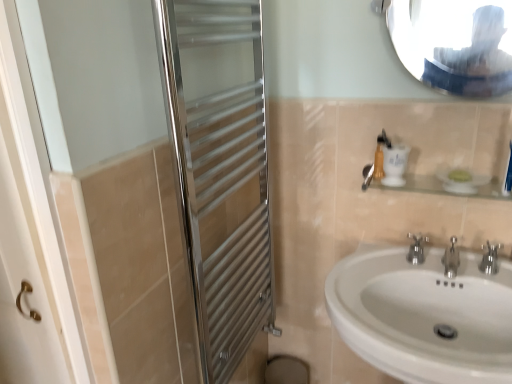
Question: Could you tell me if polished metallic faucet at lower right, which is counted as the third tap, starting from the left, is facing glossy metallic mirror at upper center?

Choices:
 (A) yes
 (B) no

Answer: (B)

Question: Would you say polished metallic faucet at lower right, which is counted as the 1th tap, starting from the right, is outside glossy metallic mirror at upper center?

Choices:
 (A) no
 (B) yes

Answer: (B)

Question: Does polished metallic faucet at lower right, which is counted as the third tap, starting from the left, lie behind glossy metallic mirror at upper center?

Choices:
 (A) no
 (B) yes

Answer: (B)

Question: Does polished metallic faucet at lower right, which is counted as the 1th tap, starting from the right, have a lesser height compared to glossy metallic mirror at upper center?

Choices:
 (A) yes
 (B) no

Answer: (A)

Question: Are polished metallic faucet at lower right, which is counted as the third tap, starting from the left, and glossy metallic mirror at upper center beside each other?

Choices:
 (A) yes
 (B) no

Answer: (B)

Question: In the image, is silver metallic tap at center, arranged as the second tap when viewed from the right, on the left side or the right side of glossy metallic mirror at upper center?

Choices:
 (A) left
 (B) right

Answer: (B)

Question: Relative to glossy metallic mirror at upper center, is silver metallic tap at center, arranged as the 2th tap when viewed from the left, in front or behind?

Choices:
 (A) front
 (B) behind

Answer: (B)

Question: Does point (457, 261) appear closer or farther from the camera than point (400, 11)?

Choices:
 (A) closer
 (B) farther

Answer: (B)

Question: Considering the positions of silver metallic tap at center, arranged as the 2th tap when viewed from the left, and glossy metallic mirror at upper center in the image, is silver metallic tap at center, arranged as the 2th tap when viewed from the left, bigger or smaller than glossy metallic mirror at upper center?

Choices:
 (A) big
 (B) small

Answer: (B)

Question: Is polished metallic faucet at lower right, which is counted as the 1th tap, starting from the right, bigger or smaller than clear glass shelf at upper right?

Choices:
 (A) small
 (B) big

Answer: (A)

Question: Does point (492, 264) appear closer or farther from the camera than point (486, 188)?

Choices:
 (A) closer
 (B) farther

Answer: (B)

Question: In terms of height, does polished metallic faucet at lower right, which is counted as the third tap, starting from the left, look taller or shorter compared to clear glass shelf at upper right?

Choices:
 (A) tall
 (B) short

Answer: (A)

Question: From a real-world perspective, is polished metallic faucet at lower right, which is counted as the 1th tap, starting from the right, positioned above or below clear glass shelf at upper right?

Choices:
 (A) above
 (B) below

Answer: (B)

Question: From the image's perspective, is chrome metallic faucet at sink center, which appears as the 3th tap when viewed from the right, located above or below white ceramic sink at lower right?

Choices:
 (A) above
 (B) below

Answer: (A)

Question: Is chrome metallic faucet at sink center, marked as the first tap in a left-to-right arrangement, to the left or to the right of white ceramic sink at lower right in the image?

Choices:
 (A) right
 (B) left

Answer: (A)